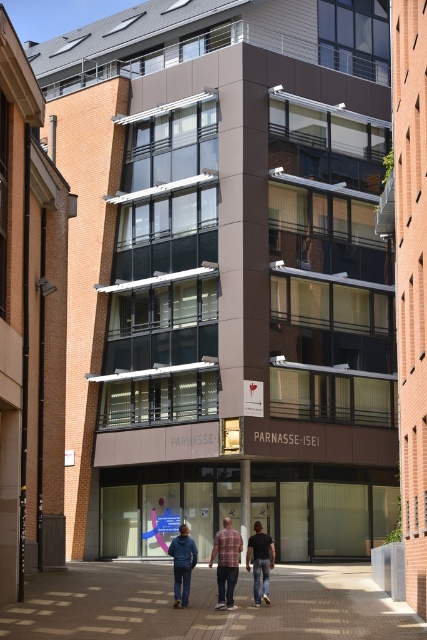
Question: Which point is farther to the camera?

Choices:
 (A) denim pants at center
 (B) dark blue jeans at center
 (C) brown brick pavement at lower center

Answer: (B)

Question: Estimate the real-world distances between objects in this image. Which object is closer to the denim pants at center?

Choices:
 (A) dark blue jeans at center
 (B) blue denim jacket at center
 (C) brown brick pavement at lower center
 (D) plaid fabric shirt at center

Answer: (D)

Question: Estimate the real-world distances between objects in this image. Which object is farther from the brown brick pavement at lower center?

Choices:
 (A) blue denim jacket at center
 (B) plaid fabric shirt at center
 (C) denim pants at center
 (D) dark blue jeans at center

Answer: (A)

Question: Does brown brick pavement at lower center have a larger size compared to plaid fabric shirt at center?

Choices:
 (A) yes
 (B) no

Answer: (A)

Question: Does denim pants at center appear on the left side of blue denim jacket at center?

Choices:
 (A) yes
 (B) no

Answer: (B)

Question: Does denim pants at center have a lesser width compared to blue denim jacket at center?

Choices:
 (A) yes
 (B) no

Answer: (B)